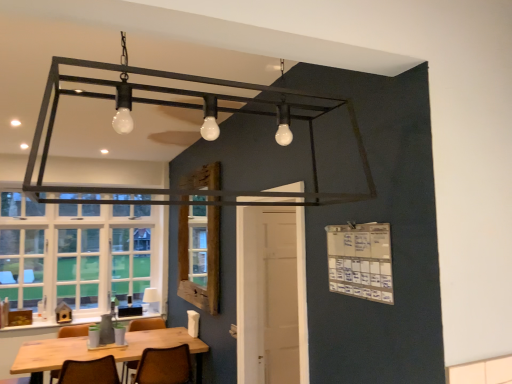
Question: Is brown leather chair at lower center, the second chair in the right-to-left sequence, directly adjacent to wooden table at lower left?

Choices:
 (A) no
 (B) yes

Answer: (A)

Question: Is brown leather chair at lower center, arranged as the 2th chair when viewed from the left, smaller than wooden table at lower left?

Choices:
 (A) no
 (B) yes

Answer: (A)

Question: From the image's perspective, does brown leather chair at lower center, arranged as the 2th chair when viewed from the left, appear higher than wooden table at lower left?

Choices:
 (A) no
 (B) yes

Answer: (A)

Question: Can you confirm if brown leather chair at lower center, the second chair in the right-to-left sequence, is shorter than wooden table at lower left?

Choices:
 (A) no
 (B) yes

Answer: (A)

Question: From a real-world perspective, is brown leather chair at lower center, the second chair in the right-to-left sequence, beneath wooden table at lower left?

Choices:
 (A) no
 (B) yes

Answer: (B)

Question: Is brown leather chair at lower center, arranged as the 2th chair when viewed from the left, facing towards wooden table at lower left?

Choices:
 (A) yes
 (B) no

Answer: (B)

Question: Is brown leather chair at lower center, arranged as the 2th chair when viewed from the left, behind white fabric lampshade at lower center?

Choices:
 (A) no
 (B) yes

Answer: (A)

Question: Does brown leather chair at lower center, arranged as the 2th chair when viewed from the left, have a smaller size compared to white fabric lampshade at lower center?

Choices:
 (A) yes
 (B) no

Answer: (B)

Question: From a real-world perspective, is brown leather chair at lower center, the second chair in the right-to-left sequence, located higher than white fabric lampshade at lower center?

Choices:
 (A) yes
 (B) no

Answer: (B)

Question: Does brown leather chair at lower center, arranged as the 2th chair when viewed from the left, have a lesser width compared to white fabric lampshade at lower center?

Choices:
 (A) yes
 (B) no

Answer: (B)

Question: Considering the relative sizes of brown leather chair at lower center, arranged as the 2th chair when viewed from the left, and white fabric lampshade at lower center in the image provided, is brown leather chair at lower center, arranged as the 2th chair when viewed from the left, taller than white fabric lampshade at lower center?

Choices:
 (A) no
 (B) yes

Answer: (B)

Question: Is brown leather chair at lower center, arranged as the 2th chair when viewed from the left, positioned in front of white fabric lampshade at lower center?

Choices:
 (A) no
 (B) yes

Answer: (B)

Question: Can you confirm if wooden table at lower left is thinner than brown leather chair at lower center, which is counted as the first chair, starting from the right?

Choices:
 (A) yes
 (B) no

Answer: (B)